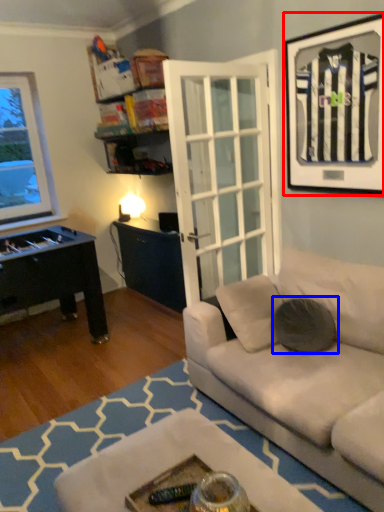
Question: Which point is closer to the camera, picture frame (highlighted by a red box) or pillow (highlighted by a blue box)?

Choices:
 (A) picture frame
 (B) pillow

Answer: (A)